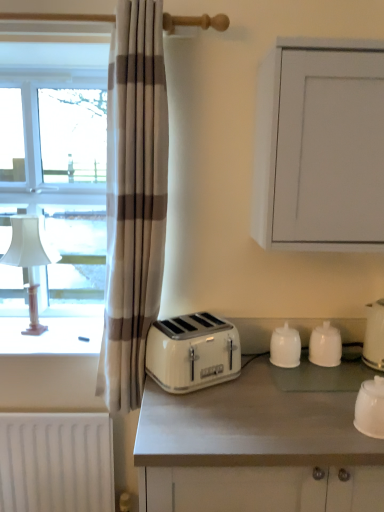
Question: In the image, is white glossy cups at center, the 3th kitchen appliance viewed from the right, on the left side or the right side of white glossy kettle at right, the 4th kitchen appliance in the left-to-right sequence?

Choices:
 (A) right
 (B) left

Answer: (B)

Question: From their relative heights in the image, would you say white glossy cups at center, which is the 1th kitchen appliance from back to front, is taller or shorter than white glossy kettle at right, the 2th kitchen appliance in the front-to-back sequence?

Choices:
 (A) tall
 (B) short

Answer: (B)

Question: Which object is positioned closest to the white plastic window sill at left?

Choices:
 (A) white matte radiator at lower left
 (B) white glossy cup at lower right, which ranks as the 2th kitchen appliance in right-to-left order
 (C) white glossy kettle at right, the 3th kitchen appliance in the back-to-front sequence
 (D) white glossy salt shaker at center, the 4th kitchen appliance positioned from the right
 (E) beige striped curtain at left

Answer: (A)

Question: Which is farther from the white plastic toaster at center?

Choices:
 (A) beige striped curtain at left
 (B) white matte cabinet at upper right
 (C) white glossy cups at center, positioned as the 2th kitchen appliance in left-to-right order
 (D) white glossy cup at lower right, which ranks as the 2th kitchen appliance in right-to-left order
 (E) white glossy kettle at right, the 3th kitchen appliance in the back-to-front sequence

Answer: (E)